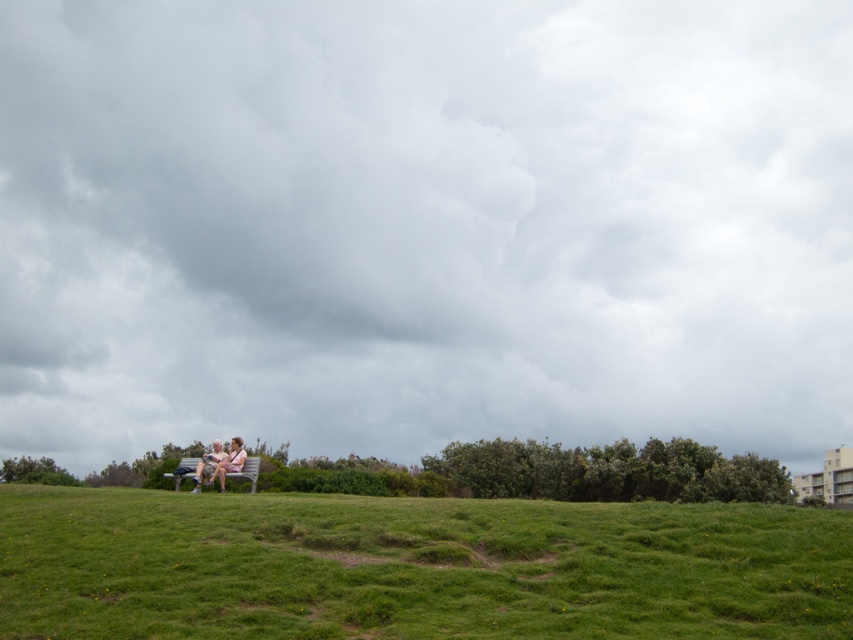
Who is lower down, cloudy sky at upper center or green grass at lower center?

green grass at lower center is below.

Who is positioned more to the left, cloudy sky at upper center or green grass at lower center?

green grass at lower center

I want to click on cloudy sky at upper center, so click(x=424, y=225).

Who is taller, green grass at lower center or matte pink fabric couple at center?

green grass at lower center is taller.

Is green grass at lower center above matte pink fabric couple at center?

No, green grass at lower center is not above matte pink fabric couple at center.

Does point (376, 525) come behind point (228, 456)?

No, (376, 525) is in front of (228, 456).

Locate an element on the screen. green grass at lower center is located at coordinates (415, 566).

Based on the photo, who is positioned more to the right, cloudy sky at upper center or matte pink fabric couple at center?

→ From the viewer's perspective, cloudy sky at upper center appears more on the right side.

Can you confirm if cloudy sky at upper center is wider than matte pink fabric couple at center?

Indeed, cloudy sky at upper center has a greater width compared to matte pink fabric couple at center.

Between point (677, 60) and point (216, 444), which one is positioned behind?

Positioned behind is point (677, 60).

In order to click on cloudy sky at upper center in this screenshot , I will do `click(424, 225)`.